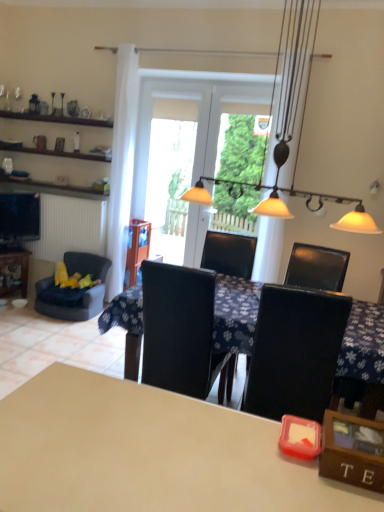
Question: Can you confirm if beige matte table at center, which is counted as the third table, starting from the back, is positioned to the left of metallic pendant lights at center?

Choices:
 (A) no
 (B) yes

Answer: (B)

Question: Does beige matte table at center, which is the first table in front-to-back order, have a lesser height compared to metallic pendant lights at center?

Choices:
 (A) no
 (B) yes

Answer: (B)

Question: From a real-world perspective, is beige matte table at center, which is counted as the third table, starting from the back, under metallic pendant lights at center?

Choices:
 (A) no
 (B) yes

Answer: (B)

Question: Does beige matte table at center, which is the first table in front-to-back order, have a smaller size compared to metallic pendant lights at center?

Choices:
 (A) no
 (B) yes

Answer: (B)

Question: Can you confirm if beige matte table at center, acting as the second table starting from the right, is wider than metallic pendant lights at center?

Choices:
 (A) yes
 (B) no

Answer: (A)

Question: From a real-world perspective, is transparent glass screen door at center, the 1th screen door in the right-to-left sequence, above or below metallic pendant lights at center?

Choices:
 (A) below
 (B) above

Answer: (A)

Question: Does point pos(134,204) appear closer or farther from the camera than point pos(269,202)?

Choices:
 (A) closer
 (B) farther

Answer: (B)

Question: In the image, is transparent glass screen door at center, which is the 2th screen door in left-to-right order, on the left side or the right side of metallic pendant lights at center?

Choices:
 (A) left
 (B) right

Answer: (A)

Question: Relative to metallic pendant lights at center, is transparent glass screen door at center, the 1th screen door in the right-to-left sequence, in front or behind?

Choices:
 (A) behind
 (B) front

Answer: (A)

Question: Visually, is velvet blue armchair at left positioned to the left or to the right of metallic pendant lights at center?

Choices:
 (A) left
 (B) right

Answer: (A)

Question: Is velvet blue armchair at left wider or thinner than metallic pendant lights at center?

Choices:
 (A) thin
 (B) wide

Answer: (B)

Question: In terms of size, does velvet blue armchair at left appear bigger or smaller than metallic pendant lights at center?

Choices:
 (A) small
 (B) big

Answer: (A)

Question: Do you think velvet blue armchair at left is within metallic pendant lights at center, or outside of it?

Choices:
 (A) outside
 (B) inside

Answer: (A)

Question: Considering the positions of transparent glass screen door at center, the 1th screen door in the right-to-left sequence, and white sheer curtain at left in the image, is transparent glass screen door at center, the 1th screen door in the right-to-left sequence, bigger or smaller than white sheer curtain at left?

Choices:
 (A) big
 (B) small

Answer: (A)

Question: From the image's perspective, is transparent glass screen door at center, the 1th screen door in the right-to-left sequence, above or below white sheer curtain at left?

Choices:
 (A) below
 (B) above

Answer: (B)